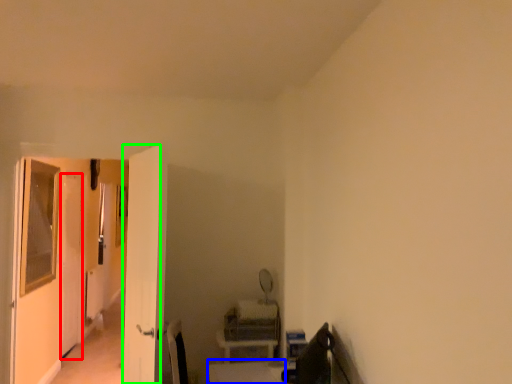
Question: Based on their relative distances, which object is nearer to screen door (highlighted by a red box)? Choose from table (highlighted by a blue box) and screen door (highlighted by a green box).

Choices:
 (A) table
 (B) screen door

Answer: (B)